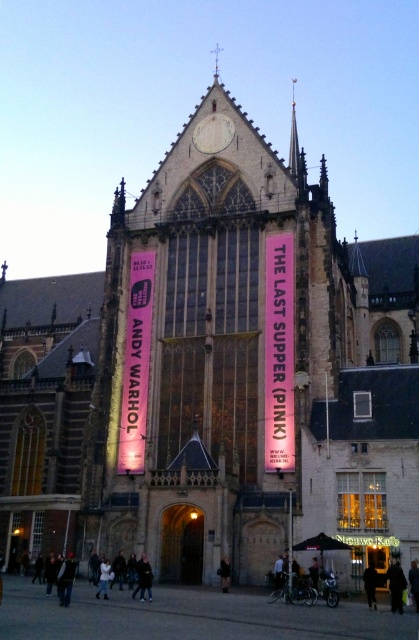
Question: In this image, where is white cotton jacket at lower center located relative to black leather jacket at lower center?

Choices:
 (A) left
 (B) right

Answer: (A)

Question: Which object is closer to the camera taking this photo?

Choices:
 (A) dark gray jacket at lower left
 (B) dark gray jacket at lower right

Answer: (A)

Question: Which point is closer to the camera taking this photo?

Choices:
 (A) (214, 122)
 (B) (108, 576)
 (C) (141, 596)

Answer: (C)

Question: Is dark gray jacket at lower left positioned in front of dark gray jacket at lower center?

Choices:
 (A) yes
 (B) no

Answer: (A)

Question: Can you confirm if matte gray clock at upper center is positioned above black matte person at lower right?

Choices:
 (A) yes
 (B) no

Answer: (A)

Question: Which point appears closest to the camera in this image?

Choices:
 (A) (62, 588)
 (B) (219, 572)

Answer: (A)